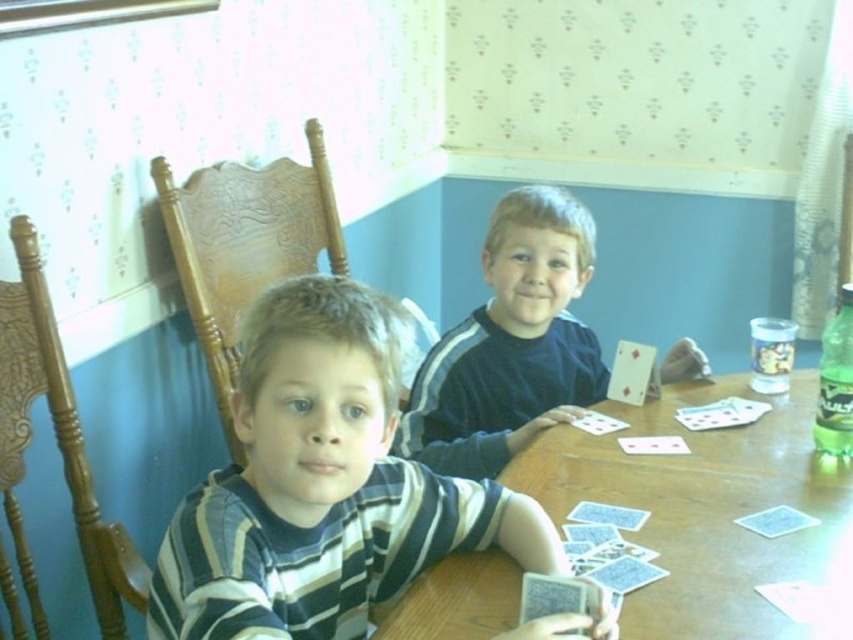
You are a child who wants to pick up the red glossy playing card at center without touching the blue cardboard cards at lower center. Can you reach it?

The blue cardboard cards at lower center and red glossy playing card at center are 19.46 inches apart from each other. Since the distance is more than a typical child hand span, you can reach the red glossy playing card at center without touching the blue cardboard cards at lower center.

You are a game organizer who needs to ensure all cards are visible to both players. Given that the blue cardboard cards at lower center and the red glossy playing card at center are of different sizes, which card should you place closer to the players to ensure visibility?

The blue cardboard cards at lower center are larger in size than the red glossy playing card at center, so placing the smaller red glossy playing card at center closer to the players would ensure better visibility.